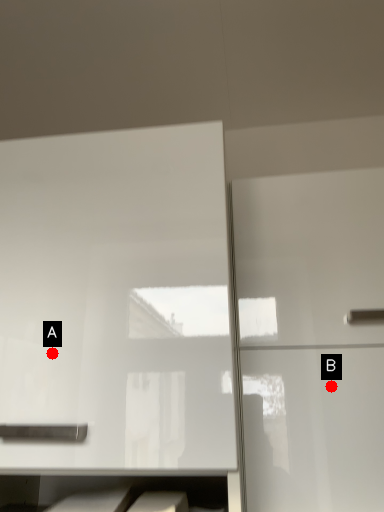
Question: Two points are circled on the image, labeled by A and B beside each circle. Which point is farther to the camera?

Choices:
 (A) A is further
 (B) B is further

Answer: (B)